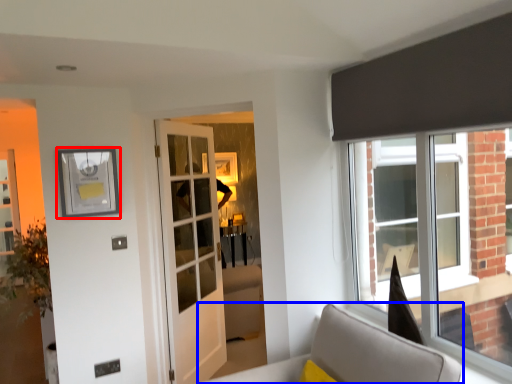
Question: Among these objects, which one is nearest to the camera, picture frame (highlighted by a red box) or furniture (highlighted by a blue box)?

Choices:
 (A) picture frame
 (B) furniture

Answer: (B)